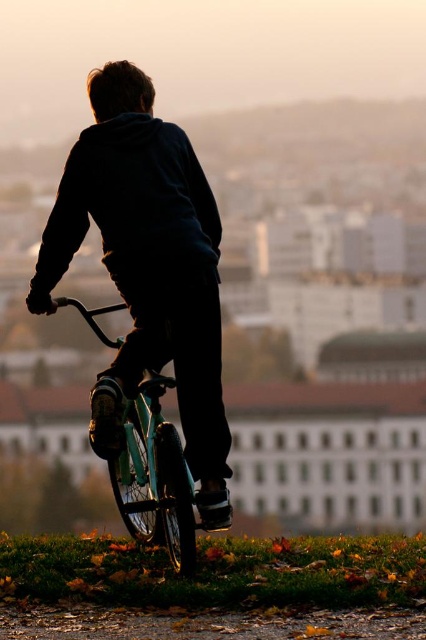
Question: Is the position of dark blue hoodie at center less distant than that of teal matte bicycle at center?

Choices:
 (A) no
 (B) yes

Answer: (A)

Question: Which of the following is the closest to the observer?

Choices:
 (A) (192, 433)
 (B) (146, 540)

Answer: (A)

Question: Among these points, which one is nearest to the camera?

Choices:
 (A) (184, 573)
 (B) (40, 308)

Answer: (A)

Question: Which object is farther from the camera taking this photo?

Choices:
 (A) dark blue hoodie at center
 (B) teal matte bicycle at center

Answer: (A)

Question: Can you confirm if dark blue hoodie at center is positioned above teal matte bicycle at center?

Choices:
 (A) no
 (B) yes

Answer: (B)

Question: Can you confirm if dark blue hoodie at center is positioned above teal matte bicycle at center?

Choices:
 (A) yes
 (B) no

Answer: (A)